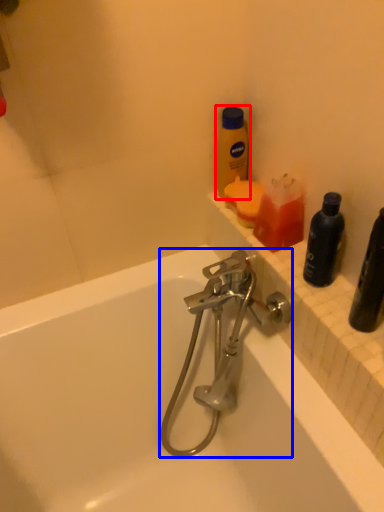
Question: Among these objects, which one is nearest to the camera, bottle (highlighted by a red box) or tap (highlighted by a blue box)?

Choices:
 (A) bottle
 (B) tap

Answer: (B)